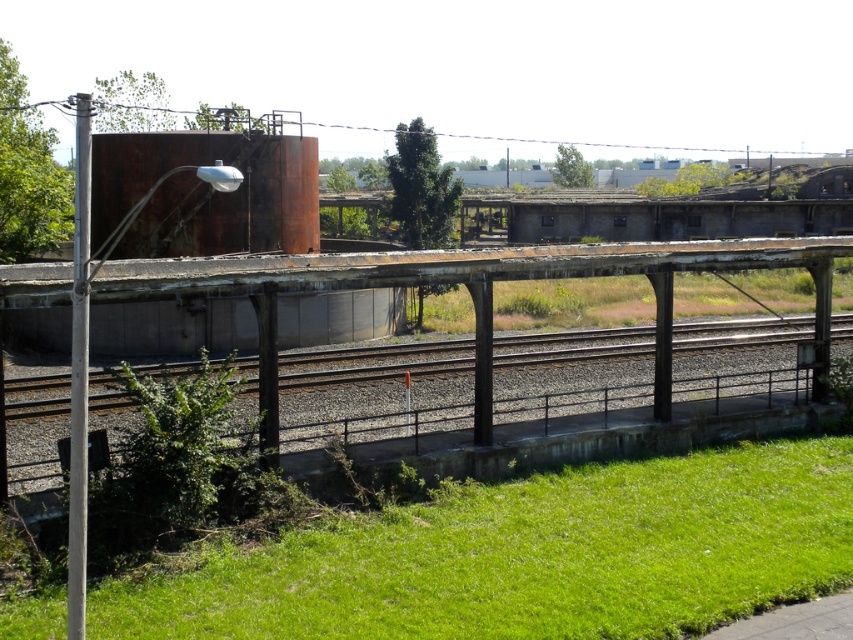
Question: Estimate the real-world distances between objects in this image. Which object is farther from the green leafy plant at lower left?

Choices:
 (A) green grass at lower center
 (B) rusty metal train track at center
 (C) rusty metal platform at center

Answer: (B)

Question: In this image, where is green grass at lower center located relative to green leafy plant at lower left?

Choices:
 (A) above
 (B) below

Answer: (B)

Question: Which point appears closest to the camera in this image?

Choices:
 (A) (753, 250)
 (B) (219, 413)

Answer: (B)

Question: Does green grass at lower center come behind rusty metal platform at center?

Choices:
 (A) yes
 (B) no

Answer: (A)

Question: Among these points, which one is nearest to the camera?

Choices:
 (A) (418, 588)
 (B) (221, 467)

Answer: (A)

Question: Can you confirm if rusty metal platform at center is smaller than rusty metal train track at center?

Choices:
 (A) no
 (B) yes

Answer: (A)